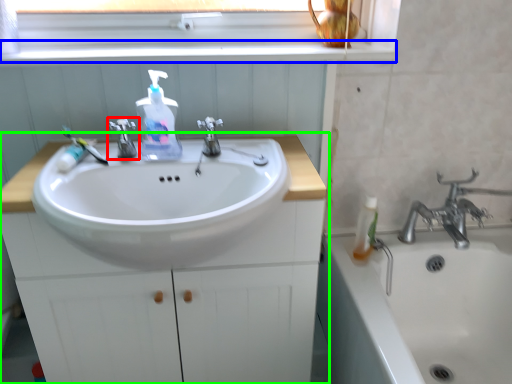
Question: Which is nearer to the tap (highlighted by a red box)? window sill (highlighted by a blue box) or bathroom cabinet (highlighted by a green box).

Choices:
 (A) window sill
 (B) bathroom cabinet

Answer: (A)